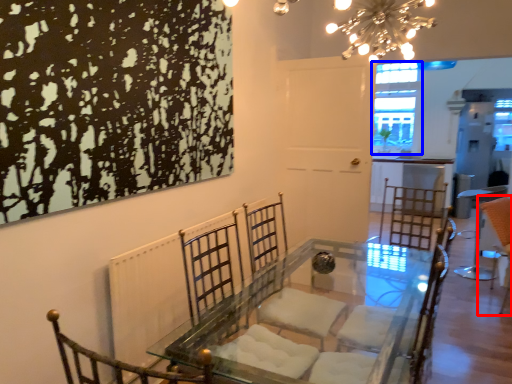
Question: Which point is closer to the camera, swivel chair (highlighted by a red box) or window (highlighted by a blue box)?

Choices:
 (A) swivel chair
 (B) window

Answer: (A)